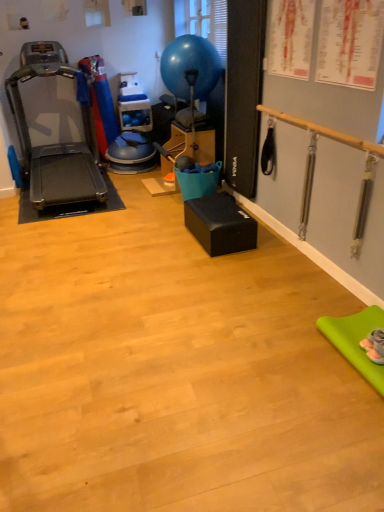
Question: Is blue rubber balloon at upper center to the left or to the right of metallic gray treadmill at left in the image?

Choices:
 (A) right
 (B) left

Answer: (A)

Question: Considering their positions, is blue rubber balloon at upper center located in front of or behind metallic gray treadmill at left?

Choices:
 (A) front
 (B) behind

Answer: (B)

Question: In terms of height, does blue rubber balloon at upper center look taller or shorter compared to metallic gray treadmill at left?

Choices:
 (A) short
 (B) tall

Answer: (A)

Question: Is metallic gray treadmill at left spatially inside blue rubber balloon at upper center, or outside of it?

Choices:
 (A) outside
 (B) inside

Answer: (A)

Question: Is metallic gray treadmill at left in front of or behind blue rubber balloon at upper center in the image?

Choices:
 (A) behind
 (B) front

Answer: (B)

Question: Visually, is metallic gray treadmill at left positioned to the left or to the right of blue rubber balloon at upper center?

Choices:
 (A) right
 (B) left

Answer: (B)

Question: Is metallic gray treadmill at left bigger or smaller than blue rubber balloon at upper center?

Choices:
 (A) big
 (B) small

Answer: (A)